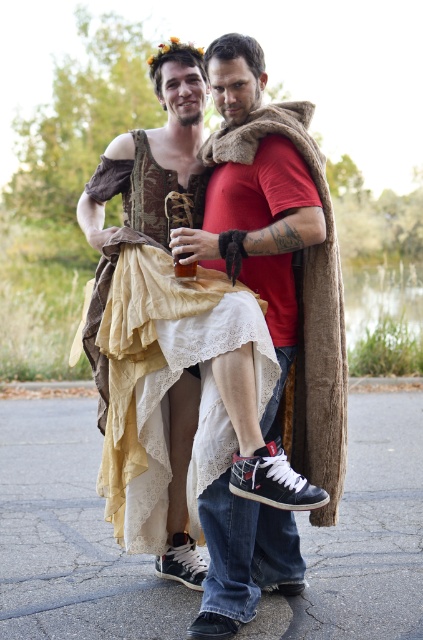
Who is lower down, matte brown fabric dress at center or translucent glass beverage at center?

matte brown fabric dress at center

Is matte brown fabric dress at center closer to camera compared to translucent glass beverage at center?

Yes, matte brown fabric dress at center is in front of translucent glass beverage at center.

Is point (129, 545) less distant than point (181, 269)?

That is False.

Image resolution: width=423 pixels, height=640 pixels. Identify the location of matte brown fabric dress at center. (206, 372).